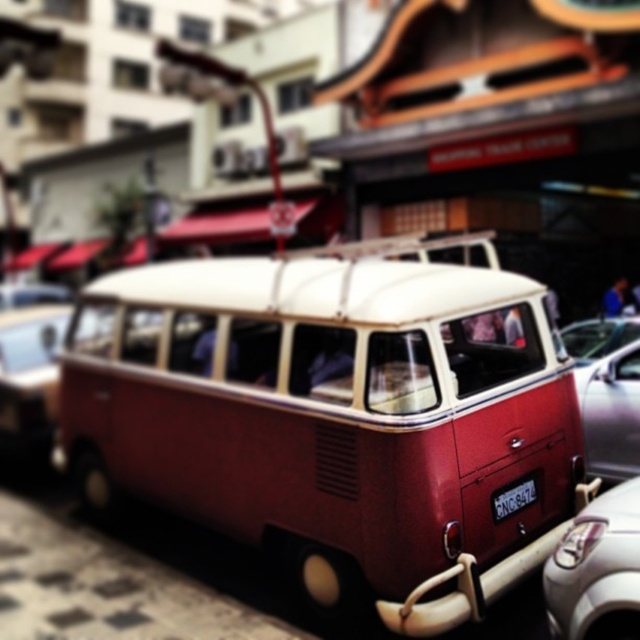
You are standing in the street and see the white glossy car at lower right and the black plastic license plate at center. Which object is closer to you?

The white glossy car at lower right is closer to you because it is in front of the black plastic license plate at center.

You are a delivery driver who needs to park your van between the white glossy car at lower right and the black plastic license plate at center. Based on the scene, can you fit your van there without overlapping either of them?

The white glossy car at lower right is above the black plastic license plate at center, so there is space between them. However, since the van is already parked off center and other cars are nearby, it might be challenging to maneuver without overlapping. Check the available space carefully before attempting to park.

You are a pedestrian standing on the sidewalk and see the matte red bus at center and the metallic silver car at right. Which vehicle is closer to the ground?

The matte red bus at center is closer to the ground because it is positioned below the metallic silver car at right.